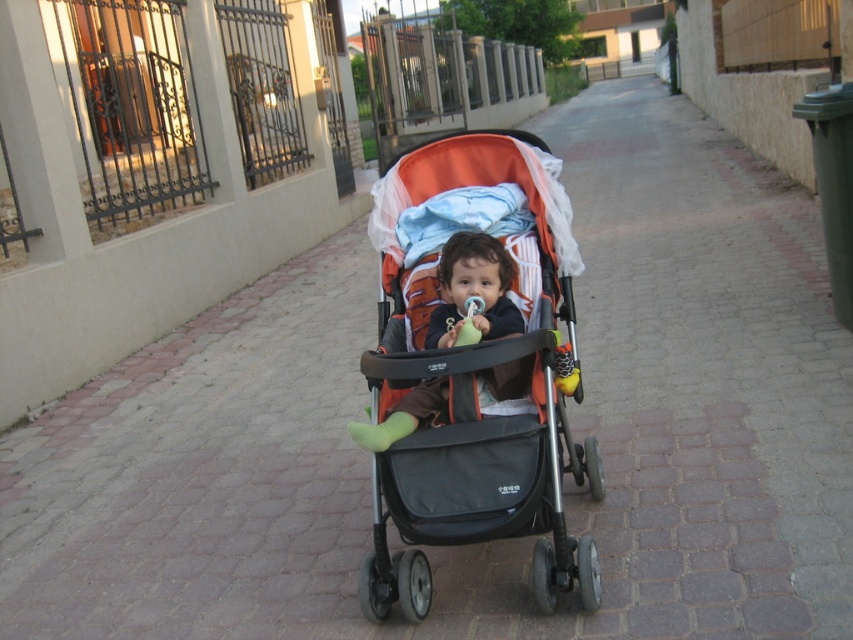
You are a parent trying to determine which orange fabric item is closer to you. You see the orange fabric baby carriage at center and the soft orange fabric stroller at center. Which one is nearer to your position?

The orange fabric baby carriage at center is closer to the viewer than the soft orange fabric stroller at center.

You are a delivery person trying to navigate through the pathway to reach the entrance of the building on the left. There is an orange fabric baby carriage at center in your way. Based on its position, can you estimate if there is enough space to pass around it without disturbing the baby?

The orange fabric baby carriage at center is positioned at coordinates approximately 0.580 on the x axis and 0.557 on the y axis. Since the exact dimensions of the pathway and the carriage are not provided, it is difficult to determine if there is sufficient space to pass around without disturbing the baby. Please exercise caution and consider alternative routes if available.